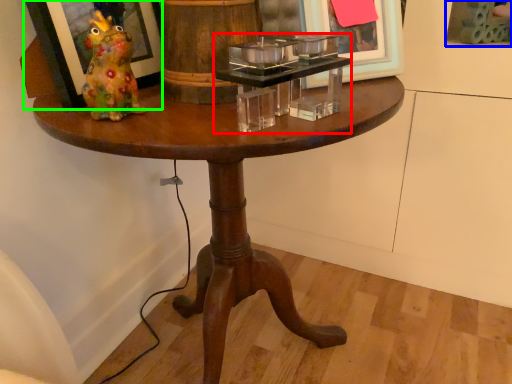
Question: Considering the real-world distances, which object is farthest from candle holder (highlighted by a red box)? picture frame (highlighted by a blue box) or picture frame (highlighted by a green box)?

Choices:
 (A) picture frame
 (B) picture frame

Answer: (A)